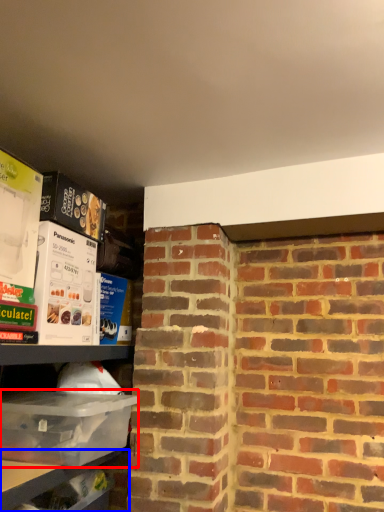
Question: Which of the following is the farthest to the observer, box (highlighted by a red box) or shelf (highlighted by a blue box)?

Choices:
 (A) box
 (B) shelf

Answer: (B)